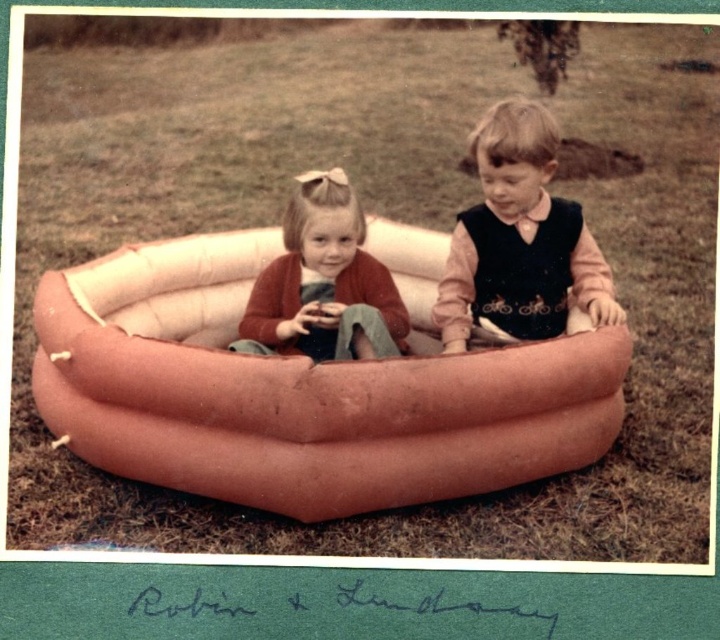
Does pink rubber boat at center appear over matte orange inflatable pool at center?

Incorrect, pink rubber boat at center is not positioned above matte orange inflatable pool at center.

Can you confirm if pink rubber boat at center is thinner than matte orange inflatable pool at center?

No.

Based on the photo, who is more forward, (544, 348) or (343, 276)?

Point (544, 348) is in front.

Locate an element on the screen. The width and height of the screenshot is (720, 640). pink rubber boat at center is located at coordinates (297, 394).

What do you see at coordinates (521, 237) in the screenshot?
I see `velvet-like brown vest at center` at bounding box center [521, 237].

Is velvet-like brown vest at center positioned at the back of matte orange inflatable pool at center?

That is True.

At what (x,y) coordinates should I click in order to perform the action: click on velvet-like brown vest at center. Please return your answer as a coordinate pair (x, y). The image size is (720, 640). Looking at the image, I should click on (521, 237).

Can you confirm if pink rubber boat at center is thinner than velvet-like brown vest at center?

No.

What do you see at coordinates (297, 394) in the screenshot?
I see `pink rubber boat at center` at bounding box center [297, 394].

Locate an element on the screen. Image resolution: width=720 pixels, height=640 pixels. pink rubber boat at center is located at coordinates (297, 394).